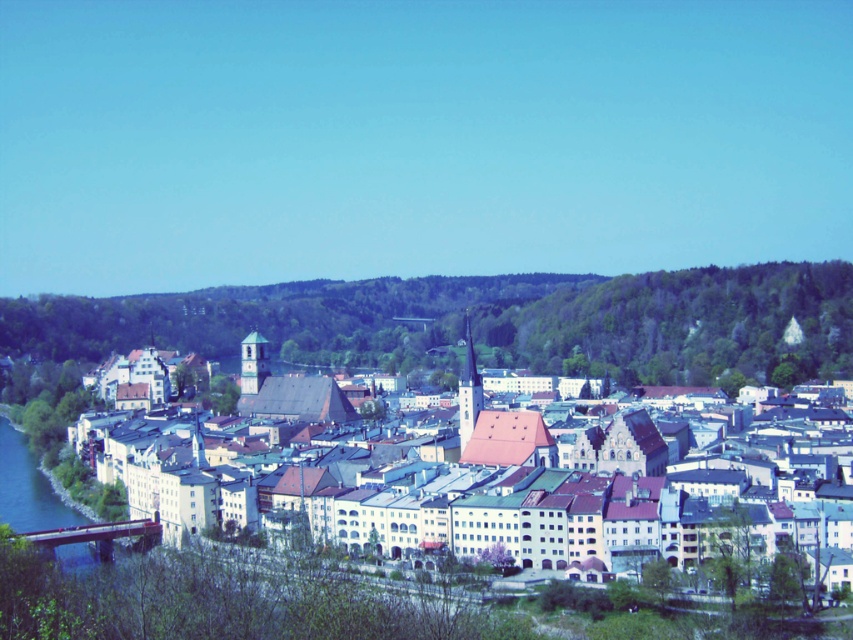
Image resolution: width=853 pixels, height=640 pixels. Describe the element at coordinates (485, 321) in the screenshot. I see `green leafy hillside at center` at that location.

Who is more distant from viewer, (x=503, y=336) or (x=692, y=545)?

The point (x=503, y=336) is more distant.

At what (x,y) coordinates should I click in order to perform the action: click on green leafy hillside at center. Please return your answer as a coordinate pair (x, y). Looking at the image, I should click on (485, 321).